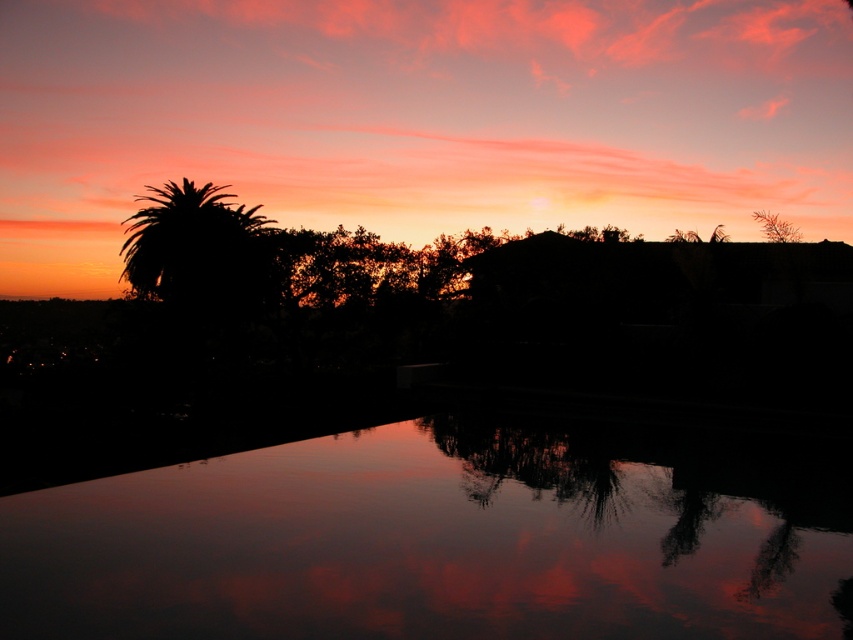
Question: In this image, where is silhouette palm tree at left located relative to green leafy tree at upper right?

Choices:
 (A) above
 (B) below

Answer: (A)

Question: Which point is farther to the camera?

Choices:
 (A) glossy reflective water at center
 (B) green leafy tree at upper right

Answer: (B)

Question: Can you confirm if glossy reflective water at center is positioned above silhouette palm tree at left?

Choices:
 (A) yes
 (B) no

Answer: (B)

Question: Among these objects, which one is farthest from the camera?

Choices:
 (A) glossy reflective water at center
 (B) silhouette palm tree at left
 (C) green leafy tree at upper right

Answer: (B)

Question: Estimate the real-world distances between objects in this image. Which object is closer to the glossy reflective water at center?

Choices:
 (A) green leafy tree at upper right
 (B) silhouette palm tree at left

Answer: (B)

Question: Observing the image, what is the correct spatial positioning of silhouette palm tree at left in reference to green leafy tree at upper right?

Choices:
 (A) right
 (B) left

Answer: (B)